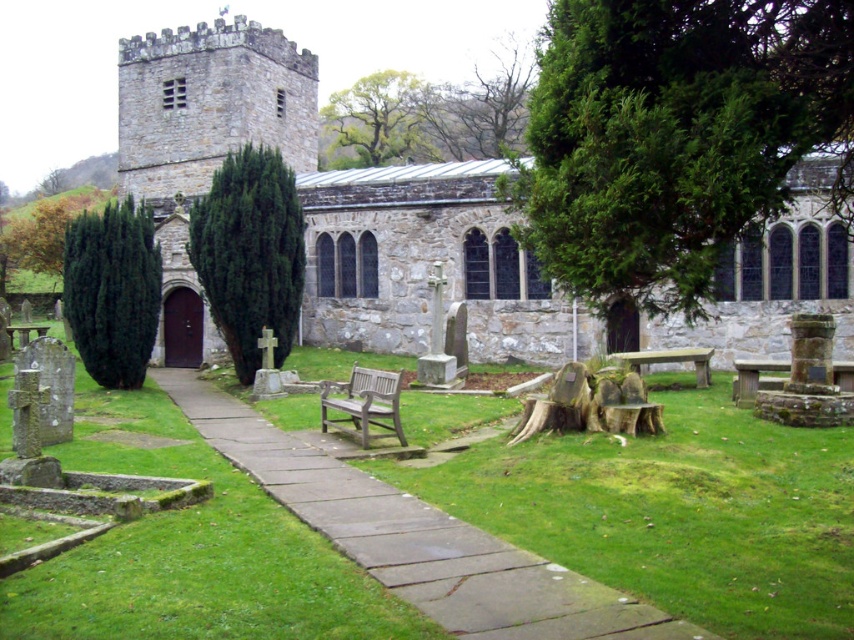
Does smooth stone path at center appear over wooden bench at lower right?

Actually, smooth stone path at center is below wooden bench at lower right.

Locate an element on the screen. smooth stone path at center is located at coordinates (416, 538).

Does green leafy tree at upper center appear on the right side of wooden bench at center?

Incorrect, green leafy tree at upper center is not on the right side of wooden bench at center.

Identify the location of green leafy tree at upper center. The image size is (854, 640). (379, 120).

Which is in front, point (369, 90) or point (322, 413)?

Point (322, 413)

Where is `green leafy tree at upper center`? This screenshot has width=854, height=640. green leafy tree at upper center is located at coordinates (379, 120).

Between point (607, 632) and point (254, 211), which one is positioned in front?

Point (607, 632) is in front.

You are a GUI agent. You are given a task and a screenshot of the screen. Output one action in this format:
    pyautogui.click(x=<x>, y=<y>)
    Task: Click on the smooth stone path at center
    
    Given the screenshot: What is the action you would take?
    coord(416,538)